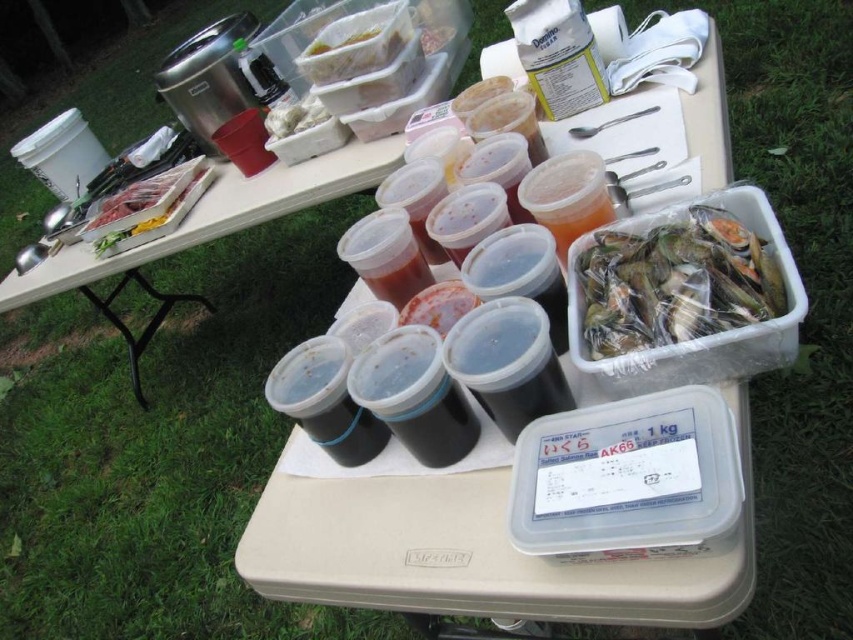
You are organizing a picnic and need to place two items in your backpack. You have the clear plastic container at upper center and the white plastic bag at upper center. The backpack has a narrow compartment that can only fit items spaced 6 inches apart. Can both items fit in the compartment without overlapping?

The distance between the clear plastic container at upper center and the white plastic bag at upper center is 6.71 inches. Since the backpack compartment requires items to be spaced 6 inches apart, the 6.71 inches distance is sufficient, so both items can fit without overlapping.

Based on the scene description, where is the clear plastic container at upper center located in the image?

The clear plastic container at upper center is located at point (358,61) in the image.